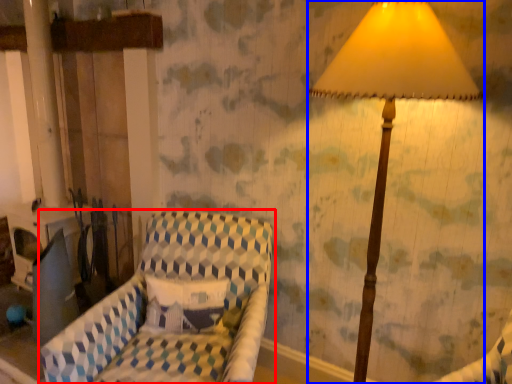
Question: Among these objects, which one is farthest to the camera, furniture (highlighted by a red box) or lamp (highlighted by a blue box)?

Choices:
 (A) furniture
 (B) lamp

Answer: (A)